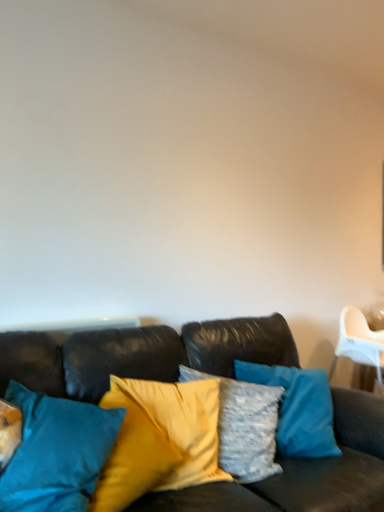
What do you see at coordinates (183, 424) in the screenshot? The image size is (384, 512). I see `silky yellow pillow at center, the first pillow when ordered from right to left` at bounding box center [183, 424].

This screenshot has height=512, width=384. Describe the element at coordinates (141, 354) in the screenshot. I see `leather couch at center` at that location.

The width and height of the screenshot is (384, 512). I want to click on silky yellow pillow at center, the 2th pillow when ordered from left to right, so click(183, 424).

Is silky yellow pillow at center, the first pillow when ordered from right to left, located outside leather couch at center?

No.

Is silky yellow pillow at center, the 2th pillow when ordered from left to right, taller than leather couch at center?

No, silky yellow pillow at center, the 2th pillow when ordered from left to right, is not taller than leather couch at center.

Find the location of `the 2nd pillow behind when counting from the leather couch at center`. the 2nd pillow behind when counting from the leather couch at center is located at coordinates (183, 424).

Between silky yellow pillow at center, the first pillow when ordered from right to left, and leather couch at center, which one appears on the right side from the viewer's perspective?

From the viewer's perspective, leather couch at center appears more on the right side.

Is silky yellow pillow at center, the first pillow when ordered from right to left, facing away from teal fabric pillow at center, marked as the 1th pillow in a left-to-right arrangement?

No.

Looking at this image, is silky yellow pillow at center, the first pillow when ordered from right to left, next to teal fabric pillow at center, the second pillow in the right-to-left sequence?

No, silky yellow pillow at center, the first pillow when ordered from right to left, is not beside teal fabric pillow at center, the second pillow in the right-to-left sequence.

From a real-world perspective, between silky yellow pillow at center, the 2th pillow when ordered from left to right, and teal fabric pillow at center, marked as the 1th pillow in a left-to-right arrangement, who is vertically higher?

teal fabric pillow at center, marked as the 1th pillow in a left-to-right arrangement, is physically above.

Does silky yellow pillow at center, the 2th pillow when ordered from left to right, have a greater width compared to teal fabric pillow at center, marked as the 1th pillow in a left-to-right arrangement?

In fact, silky yellow pillow at center, the 2th pillow when ordered from left to right, might be narrower than teal fabric pillow at center, marked as the 1th pillow in a left-to-right arrangement.

Is point (124, 353) more distant than point (108, 425)?

Yes, point (124, 353) is behind point (108, 425).

How distant is leather couch at center from teal fabric pillow at center, marked as the 1th pillow in a left-to-right arrangement?

A distance of 12.06 inches exists between leather couch at center and teal fabric pillow at center, marked as the 1th pillow in a left-to-right arrangement.

This screenshot has height=512, width=384. Find the location of `pillow that is the 2nd one when counting upward from the leather couch at center (from the image's perspective)`. pillow that is the 2nd one when counting upward from the leather couch at center (from the image's perspective) is located at coordinates (56, 452).

Does leather couch at center appear on the right side of teal fabric pillow at center, the second pillow in the right-to-left sequence?

Yes, leather couch at center is to the right of teal fabric pillow at center, the second pillow in the right-to-left sequence.

Is point (9, 507) closer to viewer compared to point (361, 403)?

Yes, point (9, 507) is closer to viewer.

From a real-world perspective, is teal fabric pillow at center, marked as the 1th pillow in a left-to-right arrangement, physically below leather couch at center?

No, from a real-world perspective, teal fabric pillow at center, marked as the 1th pillow in a left-to-right arrangement, is not below leather couch at center.

The width and height of the screenshot is (384, 512). What are the coordinates of `studio couch to the right of teal fabric pillow at center, marked as the 1th pillow in a left-to-right arrangement` in the screenshot? It's located at (141, 354).

Could you tell me if teal fabric pillow at center, marked as the 1th pillow in a left-to-right arrangement, is facing leather couch at center?

Yes, teal fabric pillow at center, marked as the 1th pillow in a left-to-right arrangement, faces towards leather couch at center.

Is the surface of teal fabric pillow at center, the second pillow in the right-to-left sequence, in direct contact with silky yellow pillow at center, the 2th pillow when ordered from left to right?

No.

From a real-world perspective, who is located lower, teal fabric pillow at center, the second pillow in the right-to-left sequence, or silky yellow pillow at center, the first pillow when ordered from right to left?

silky yellow pillow at center, the first pillow when ordered from right to left, is physically lower.

Is teal fabric pillow at center, marked as the 1th pillow in a left-to-right arrangement, aimed at silky yellow pillow at center, the 2th pillow when ordered from left to right?

No.

In terms of height, does teal fabric pillow at center, the second pillow in the right-to-left sequence, look taller or shorter compared to silky yellow pillow at center, the 2th pillow when ordered from left to right?

In the image, teal fabric pillow at center, the second pillow in the right-to-left sequence, appears to be taller than silky yellow pillow at center, the 2th pillow when ordered from left to right.

Is point (376, 412) positioned behind point (193, 389)?

No, it is not.

Could you tell me if leather couch at center is turned towards silky yellow pillow at center, the 2th pillow when ordered from left to right?

Yes, leather couch at center faces towards silky yellow pillow at center, the 2th pillow when ordered from left to right.

Is leather couch at center far away from silky yellow pillow at center, the 2th pillow when ordered from left to right?

No, leather couch at center is not far away from silky yellow pillow at center, the 2th pillow when ordered from left to right.

Which object is closer to the camera, leather couch at center or silky yellow pillow at center, the first pillow when ordered from right to left?

leather couch at center is more forward.

Identify the location of studio couch in front of the silky yellow pillow at center, the first pillow when ordered from right to left. (141, 354).

The width and height of the screenshot is (384, 512). I want to click on pillow on the left of silky yellow pillow at center, the first pillow when ordered from right to left, so click(x=56, y=452).

Considering their positions, is silky yellow pillow at center, the 2th pillow when ordered from left to right, positioned closer to teal fabric pillow at center, the second pillow in the right-to-left sequence, than leather couch at center?

leather couch at center lies closer to teal fabric pillow at center, the second pillow in the right-to-left sequence, than the other object.

Considering their positions, is leather couch at center positioned further to silky yellow pillow at center, the first pillow when ordered from right to left, than teal fabric pillow at center, marked as the 1th pillow in a left-to-right arrangement?

teal fabric pillow at center, marked as the 1th pillow in a left-to-right arrangement, is positioned further to the anchor silky yellow pillow at center, the first pillow when ordered from right to left.

Considering their positions, is teal fabric pillow at center, the second pillow in the right-to-left sequence, positioned further to leather couch at center than silky yellow pillow at center, the 2th pillow when ordered from left to right?

teal fabric pillow at center, the second pillow in the right-to-left sequence, is further to leather couch at center.

When comparing their distances from leather couch at center, does silky yellow pillow at center, the first pillow when ordered from right to left, or teal fabric pillow at center, the second pillow in the right-to-left sequence, seem closer?

Among the two, silky yellow pillow at center, the first pillow when ordered from right to left, is located nearer to leather couch at center.

Which object lies nearer to the anchor point silky yellow pillow at center, the first pillow when ordered from right to left, teal fabric pillow at center, the second pillow in the right-to-left sequence, or leather couch at center?

Among the two, leather couch at center is located nearer to silky yellow pillow at center, the first pillow when ordered from right to left.

Looking at the image, which one is located closer to teal fabric pillow at center, marked as the 1th pillow in a left-to-right arrangement, leather couch at center or silky yellow pillow at center, the 2th pillow when ordered from left to right?

Based on the image, leather couch at center appears to be nearer to teal fabric pillow at center, marked as the 1th pillow in a left-to-right arrangement.

The height and width of the screenshot is (512, 384). I want to click on pillow located between teal fabric pillow at center, marked as the 1th pillow in a left-to-right arrangement, and leather couch at center in the left-right direction, so click(183, 424).